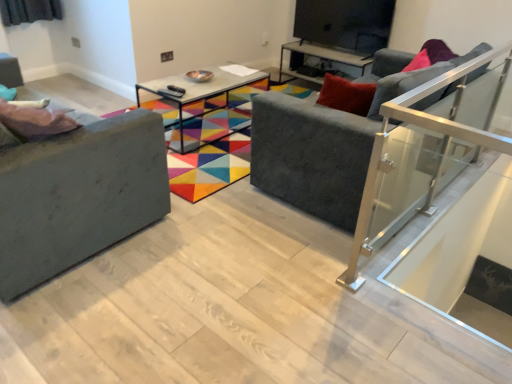
Question: Which direction should I rotate to look at metallic glass table at center, the first table when ordered from back to front?

Choices:
 (A) right
 (B) left

Answer: (A)

Question: Is velvet grey couch at center, the 2th studio couch in the left-to-right sequence, to the left of metallic glass table at center, the second table positioned from the left, from the viewer's perspective?

Choices:
 (A) yes
 (B) no

Answer: (B)

Question: Considering the relative sizes of velvet grey couch at center, the 2th studio couch in the left-to-right sequence, and metallic glass table at center, the first table when ordered from back to front, in the image provided, is velvet grey couch at center, the 2th studio couch in the left-to-right sequence, thinner than metallic glass table at center, the first table when ordered from back to front,?

Choices:
 (A) no
 (B) yes

Answer: (A)

Question: Is velvet grey couch at center, the 2th studio couch in the left-to-right sequence, looking in the opposite direction of metallic glass table at center, the second table positioned from the left?

Choices:
 (A) yes
 (B) no

Answer: (B)

Question: Considering the relative sizes of velvet grey couch at center, the 1th studio couch from the right, and metallic glass table at center, the first table when ordered from back to front, in the image provided, is velvet grey couch at center, the 1th studio couch from the right, smaller than metallic glass table at center, the first table when ordered from back to front,?

Choices:
 (A) yes
 (B) no

Answer: (B)

Question: Does velvet grey couch at center, the 1th studio couch from the right, come behind metallic glass table at center, the second table viewed from the front?

Choices:
 (A) no
 (B) yes

Answer: (A)

Question: Is velvet grey couch at center, the 1th studio couch from the right, closer to the viewer compared to metallic glass table at center, the first table when ordered from back to front?

Choices:
 (A) yes
 (B) no

Answer: (A)

Question: Considering the relative sizes of matte black tv stand at upper center and metallic glass table at center, placed as the first table when sorted from right to left, in the image provided, is matte black tv stand at upper center smaller than metallic glass table at center, placed as the first table when sorted from right to left,?

Choices:
 (A) no
 (B) yes

Answer: (B)

Question: From the image's perspective, does matte black tv stand at upper center appear higher than metallic glass table at center, the second table positioned from the left?

Choices:
 (A) yes
 (B) no

Answer: (A)

Question: Does matte black tv stand at upper center come behind metallic glass table at center, the first table when ordered from back to front?

Choices:
 (A) no
 (B) yes

Answer: (A)

Question: From the image's perspective, is matte black tv stand at upper center under metallic glass table at center, the second table positioned from the left?

Choices:
 (A) no
 (B) yes

Answer: (A)

Question: Is metallic glass table at center, the first table when ordered from back to front, surrounded by matte black tv stand at upper center?

Choices:
 (A) no
 (B) yes

Answer: (A)

Question: Is matte black tv stand at upper center next to metallic glass table at center, the second table viewed from the front?

Choices:
 (A) yes
 (B) no

Answer: (B)

Question: Is matte gray couch at left, the 1th studio couch viewed from the left, wider than pink fabric pillow at left?

Choices:
 (A) yes
 (B) no

Answer: (A)